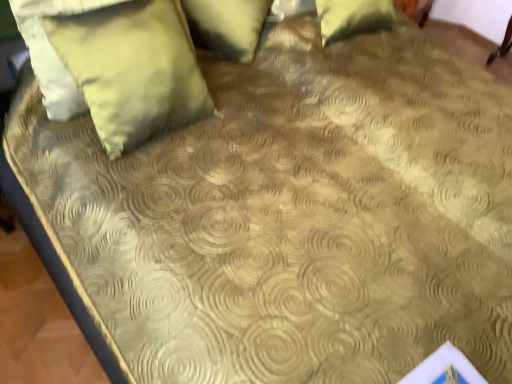
Question: In terms of size, does satin yellow pillow at upper left, which is counted as the 1th pillow, starting from the bottom, appear bigger or smaller than green fabric pillow at upper center, the 2th pillow positioned from the bottom?

Choices:
 (A) small
 (B) big

Answer: (A)

Question: Is point pyautogui.click(x=106, y=99) closer or farther from the camera than point pyautogui.click(x=245, y=11)?

Choices:
 (A) closer
 (B) farther

Answer: (A)

Question: Is satin yellow pillow at upper left, which is counted as the 1th pillow, starting from the bottom, to the left or to the right of green fabric pillow at upper center, the 2th pillow positioned from the bottom, in the image?

Choices:
 (A) right
 (B) left

Answer: (B)

Question: From a real-world perspective, is green fabric pillow at upper center, the 2th pillow positioned from the bottom, positioned above or below satin yellow pillow at upper left, which is counted as the 1th pillow, starting from the bottom?

Choices:
 (A) below
 (B) above

Answer: (A)

Question: Considering the positions of point (251, 24) and point (101, 109), is point (251, 24) closer or farther from the camera than point (101, 109)?

Choices:
 (A) closer
 (B) farther

Answer: (B)

Question: Is green fabric pillow at upper center, the 1th pillow positioned from the top, situated inside satin yellow pillow at upper left, which is the second pillow in top-to-bottom order, or outside?

Choices:
 (A) inside
 (B) outside

Answer: (B)

Question: Is green fabric pillow at upper center, the 2th pillow positioned from the bottom, taller or shorter than satin yellow pillow at upper left, which is the second pillow in top-to-bottom order?

Choices:
 (A) short
 (B) tall

Answer: (A)